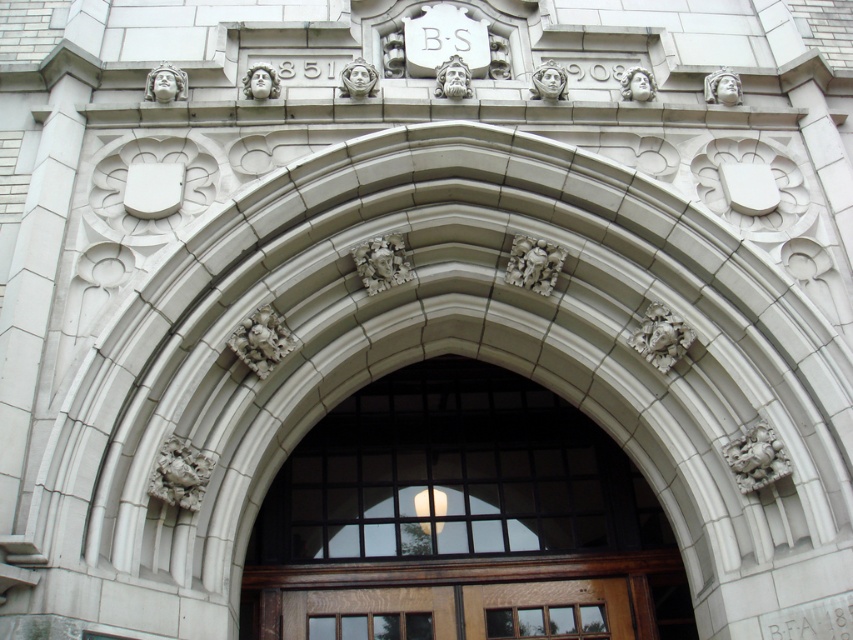
You are an architect inspecting the entrance of a historic building. You notice two doors, the wooden door at center and the mahogany wood door at center. Which door is larger in size?

The wooden door at center is bigger than the mahogany wood door at center.

You are a photographer taking a picture of the grand entrance. You notice two points marked on your screen at coordinates point (410, 516) and point (416, 605). If you want to focus on the closer point to ensure sharpness, which coordinate should you select?

Point (416, 605) is closer to the camera than point (410, 516), so you should focus on point (416, 605) to ensure sharpness.